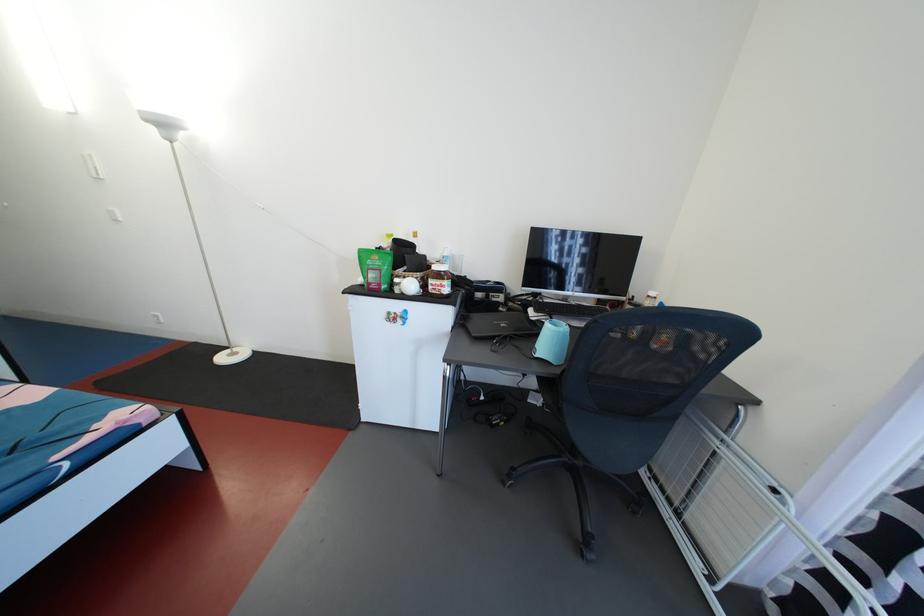
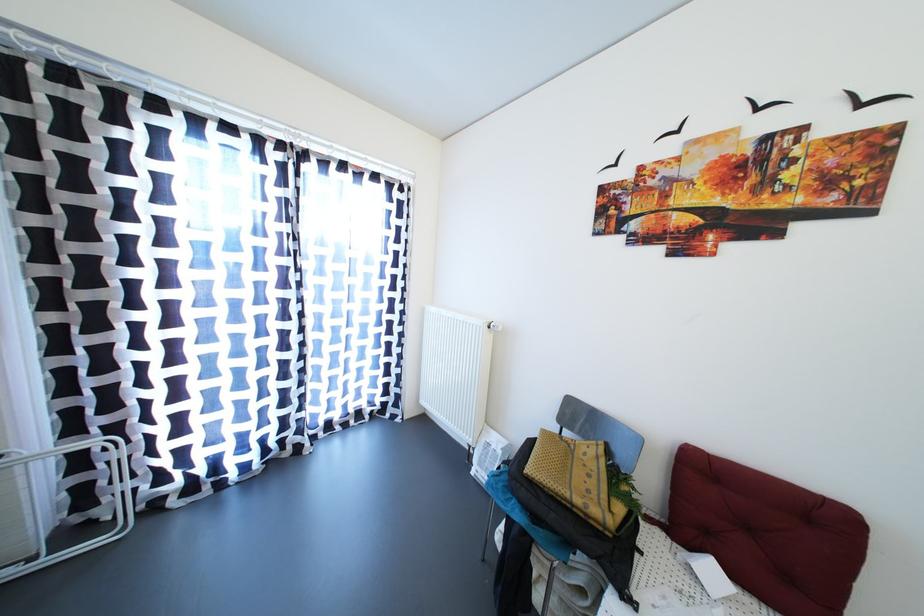
The point at (x=718, y=586) is marked in the first image. Where is the corresponding point in the second image?

(39, 564)